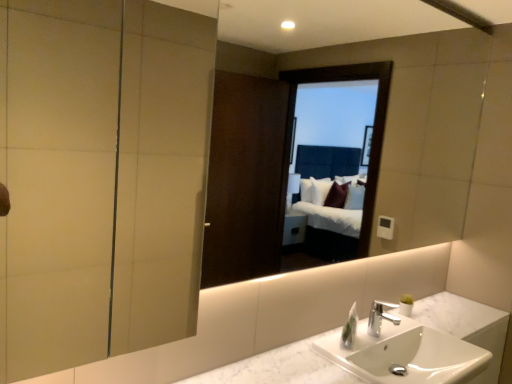
Question: Could you tell me if white marble counter top at center is facing silver metallic faucet at center?

Choices:
 (A) no
 (B) yes

Answer: (A)

Question: Is there a large distance between white marble counter top at center and silver metallic faucet at center?

Choices:
 (A) no
 (B) yes

Answer: (A)

Question: From the image's perspective, is white marble counter top at center on top of silver metallic faucet at center?

Choices:
 (A) yes
 (B) no

Answer: (B)

Question: From a real-world perspective, is white marble counter top at center located higher than silver metallic faucet at center?

Choices:
 (A) no
 (B) yes

Answer: (A)

Question: Is white marble counter top at center not inside silver metallic faucet at center?

Choices:
 (A) yes
 (B) no

Answer: (A)

Question: Is silver metallic faucet at center to the left or to the right of white marble sink at lower center in the image?

Choices:
 (A) right
 (B) left

Answer: (B)

Question: Is point (375, 311) closer or farther from the camera than point (480, 339)?

Choices:
 (A) farther
 (B) closer

Answer: (B)

Question: In terms of height, does silver metallic faucet at center look taller or shorter compared to white marble sink at lower center?

Choices:
 (A) short
 (B) tall

Answer: (A)

Question: In the image, is silver metallic faucet at center positioned in front of or behind white marble sink at lower center?

Choices:
 (A) behind
 (B) front

Answer: (A)

Question: Relative to white glossy soap dispenser at lower right, is silver metallic faucet at center in front or behind?

Choices:
 (A) behind
 (B) front

Answer: (A)

Question: Do you think silver metallic faucet at center is within white glossy soap dispenser at lower right, or outside of it?

Choices:
 (A) inside
 (B) outside

Answer: (B)

Question: Considering the positions of silver metallic faucet at center and white glossy soap dispenser at lower right in the image, is silver metallic faucet at center bigger or smaller than white glossy soap dispenser at lower right?

Choices:
 (A) small
 (B) big

Answer: (B)

Question: From a real-world perspective, is silver metallic faucet at center physically located above or below white glossy soap dispenser at lower right?

Choices:
 (A) above
 (B) below

Answer: (A)

Question: Is white marble sink at lower center situated inside matte glass screen door at upper left or outside?

Choices:
 (A) inside
 (B) outside

Answer: (B)

Question: Is white marble sink at lower center bigger or smaller than matte glass screen door at upper left?

Choices:
 (A) small
 (B) big

Answer: (A)